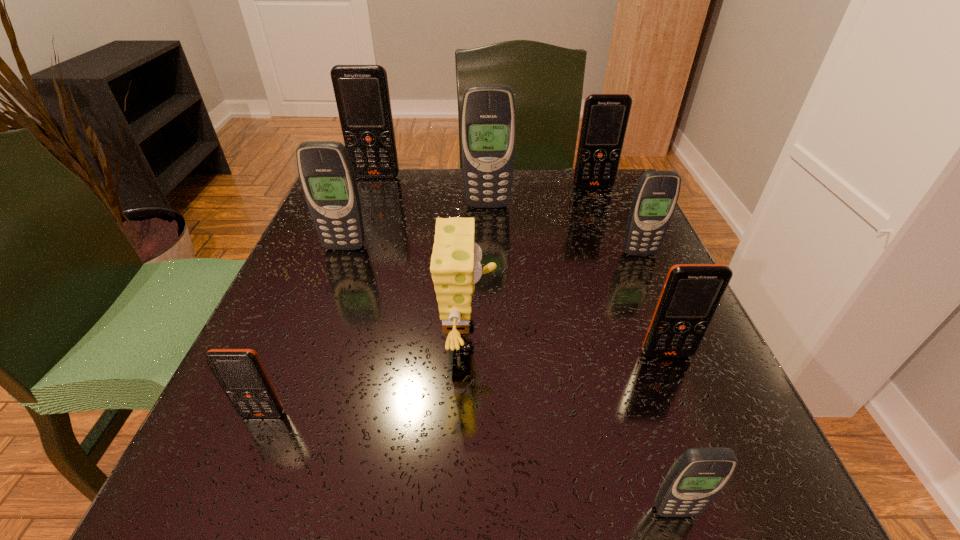
This screenshot has width=960, height=540. In order to click on vacant space situated 0.210m on the screen of the second smallest gray cellular telephone in this screenshot , I will do `click(676, 335)`.

Identify the location of vacant point located 0.220m on the screen of the third biggest orange cellular telephone. (729, 508).

Identify the location of vacant area situated 0.100m on the screen of the seventh farthest cellular telephone. (230, 494).

This screenshot has width=960, height=540. Identify the location of object at the near edge. (698, 475).

Locate an element on the screen. The width and height of the screenshot is (960, 540). object that is at the far left corner is located at coordinates (x=362, y=96).

Image resolution: width=960 pixels, height=540 pixels. Find the location of `object positioned at the far right corner`. object positioned at the far right corner is located at coordinates [605, 117].

Image resolution: width=960 pixels, height=540 pixels. In order to click on object that is at the near right corner in this screenshot , I will do click(698, 475).

This screenshot has height=540, width=960. I want to click on vacant space at the far edge of the desktop, so click(x=561, y=213).

This screenshot has height=540, width=960. In the image, there is a desktop. What are the coordinates of `free space at the near edge` in the screenshot? It's located at (607, 515).

In the image, there is a desktop. At what (x,y) coordinates should I click in order to perform the action: click on vacant space at the left edge. Please return your answer as a coordinate pair (x, y). The image size is (960, 540). Looking at the image, I should click on (313, 340).